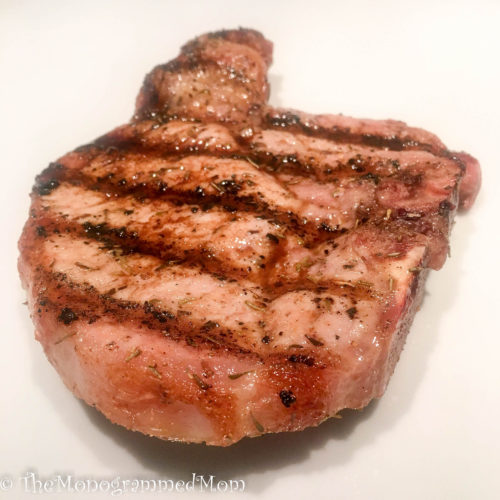
The image size is (500, 500). What are the coordinates of `white surface` in the screenshot? It's located at (427, 435).